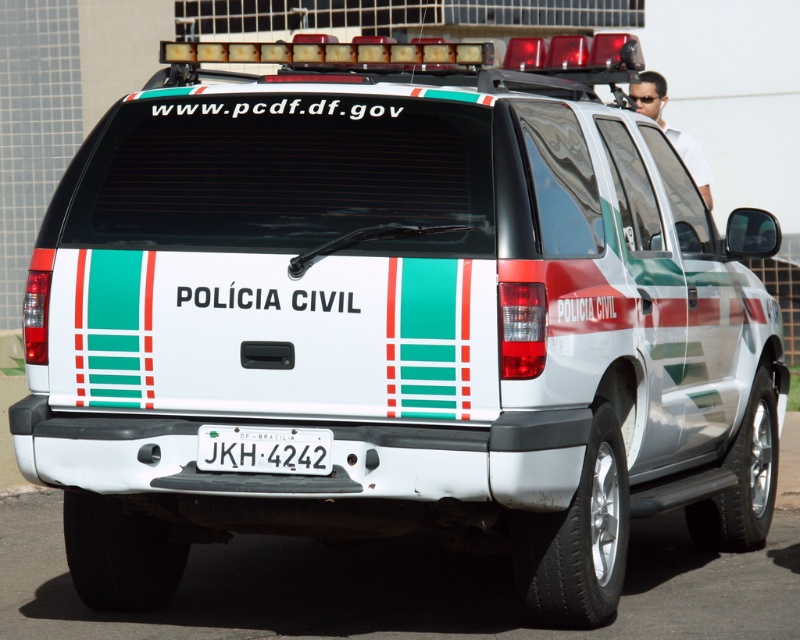
Can you confirm if white plastic license plate at center is shorter than white shirt at upper right?

Yes.

Does point (240, 449) come closer to viewer compared to point (642, 108)?

Yes, it is in front of point (642, 108).

Is point (202, 433) in front of point (682, 150)?

Yes, it is.

Where is `white plastic license plate at center`? The height and width of the screenshot is (640, 800). white plastic license plate at center is located at coordinates (264, 449).